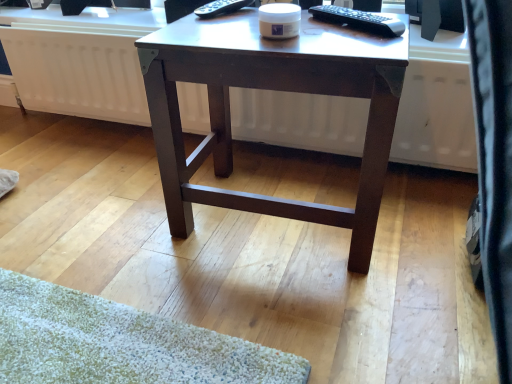
Question: Considering the relative positions of black glossy monitor at upper right and black plastic remote control at upper center, the 2th remote control from the right, in the image provided, is black glossy monitor at upper right to the left or to the right of black plastic remote control at upper center, the 2th remote control from the right,?

Choices:
 (A) right
 (B) left

Answer: (A)

Question: From a real-world perspective, is black glossy monitor at upper right physically located above or below black plastic remote control at upper center, which is the second remote control in front-to-back order?

Choices:
 (A) below
 (B) above

Answer: (A)

Question: Which of these objects is positioned farthest from the black plastic remote control at upper right, the second remote control in the left-to-right sequence?

Choices:
 (A) dark brown wood desk at center
 (B) white matte radiator at center
 (C) black glossy monitor at upper right
 (D) black plastic remote control at upper center, the 1th remote control positioned from the back

Answer: (B)

Question: Which of these objects is positioned closest to the white matte radiator at center?

Choices:
 (A) dark brown wood desk at center
 (B) black glossy monitor at upper right
 (C) black plastic remote control at upper right, the second remote control when ordered from back to front
 (D) black plastic remote control at upper center, which is the second remote control in front-to-back order

Answer: (A)